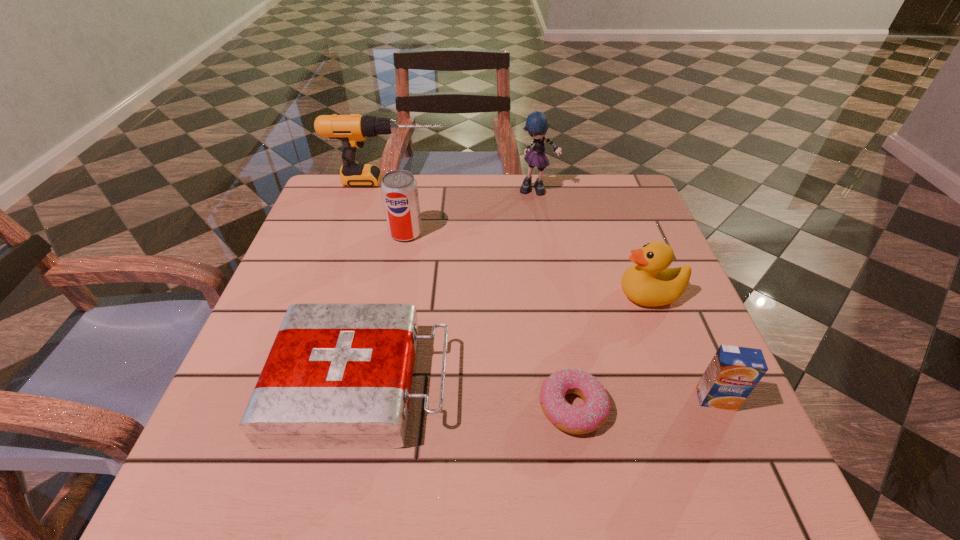
Where is `rag doll`? rag doll is located at coordinates (537, 125).

Find the location of a particular element. drill is located at coordinates (352, 130).

Locate an element on the screen. Image resolution: width=960 pixels, height=540 pixels. the third farthest object is located at coordinates (399, 189).

I want to click on the fourth farthest object, so click(650, 282).

Image resolution: width=960 pixels, height=540 pixels. Find the location of `the fifth tallest object`. the fifth tallest object is located at coordinates (733, 373).

Identify the location of the first-aid kit. This screenshot has width=960, height=540. (338, 376).

Locate an element on the screen. The image size is (960, 540). doughnut is located at coordinates point(586,418).

This screenshot has width=960, height=540. I want to click on vacant space located on the front-facing side of the rag doll, so click(x=549, y=259).

At what (x,y) coordinates should I click in order to perform the action: click on vacant position located on the handle side of the drill. Please return your answer as a coordinate pair (x, y). This screenshot has height=540, width=960. Looking at the image, I should click on (567, 181).

Where is `vacant space situated 0.130m on the right of the third farthest object`? Image resolution: width=960 pixels, height=540 pixels. vacant space situated 0.130m on the right of the third farthest object is located at coordinates (476, 233).